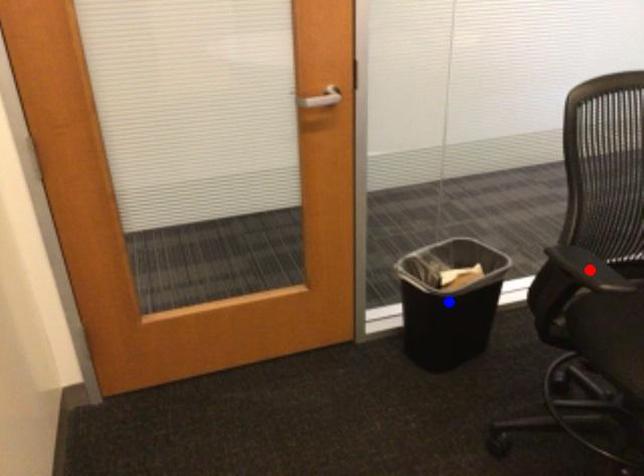
Question: Two points are marked on the image. Which point is closer to the camera?

Choices:
 (A) Blue point is closer.
 (B) Red point is closer.

Answer: (B)